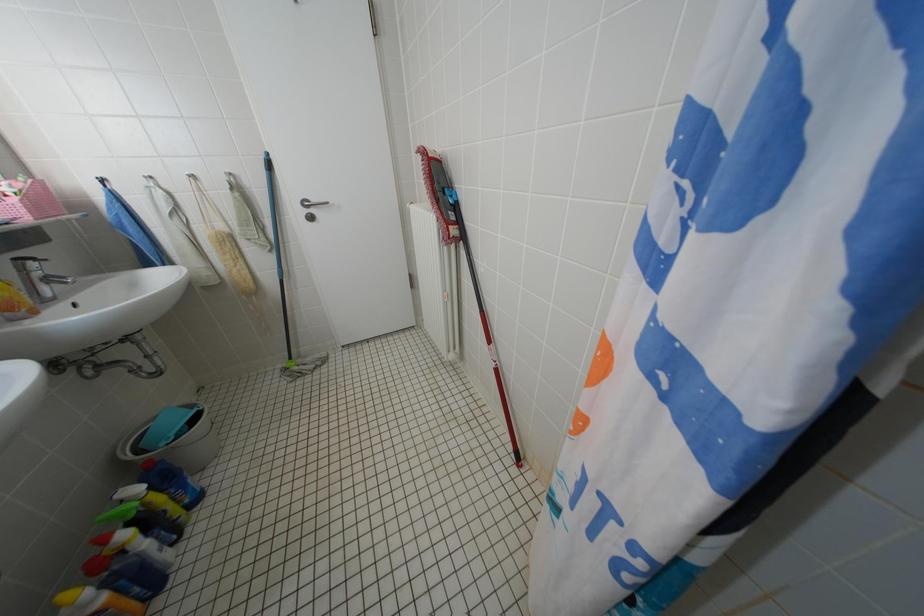
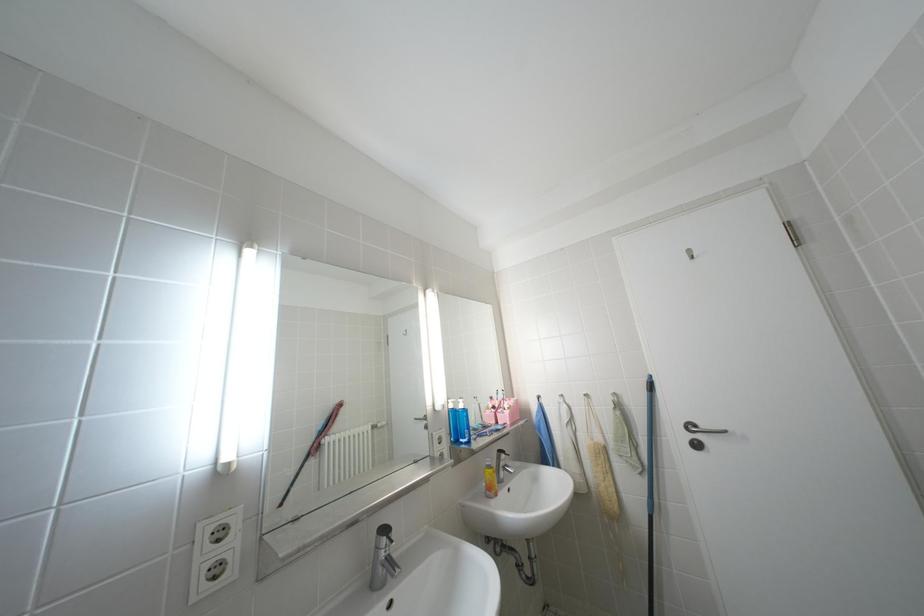
In the scene shown: How did the camera likely rotate?

The camera's rotation is toward left-up.